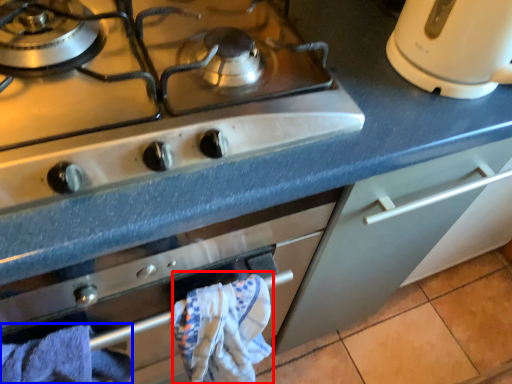
Question: Among these objects, which one is farthest to the camera, bath towel (highlighted by a red box) or bath towel (highlighted by a blue box)?

Choices:
 (A) bath towel
 (B) bath towel

Answer: (A)